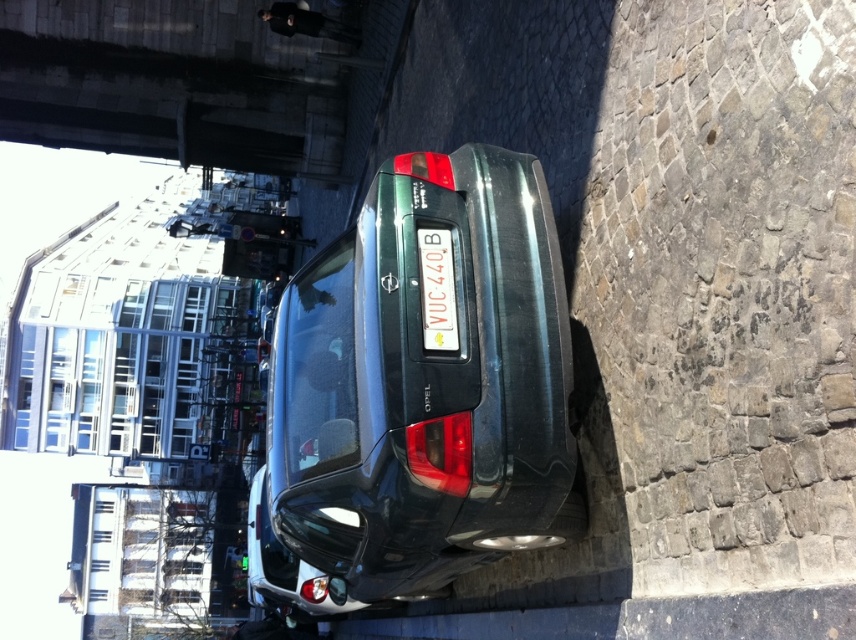
Question: Is glassy transparent building at upper left positioned at the back of white plastic license plate at center?

Choices:
 (A) no
 (B) yes

Answer: (B)

Question: Which point is farther to the camera?

Choices:
 (A) (153, 129)
 (B) (423, 216)

Answer: (A)

Question: Among these points, which one is nearest to the camera?

Choices:
 (A) (538, 333)
 (B) (227, 172)
 (C) (337, 90)
 (D) (423, 339)

Answer: (D)

Question: Which object is closer to the camera taking this photo?

Choices:
 (A) concrete bridge at upper left
 (B) metallic green car at center
 (C) glassy transparent building at upper left
 (D) white plastic license plate at center

Answer: (B)

Question: Is metallic green car at center above concrete bridge at upper left?

Choices:
 (A) yes
 (B) no

Answer: (B)

Question: Does metallic green car at center appear on the left side of glassy transparent building at upper left?

Choices:
 (A) no
 (B) yes

Answer: (A)